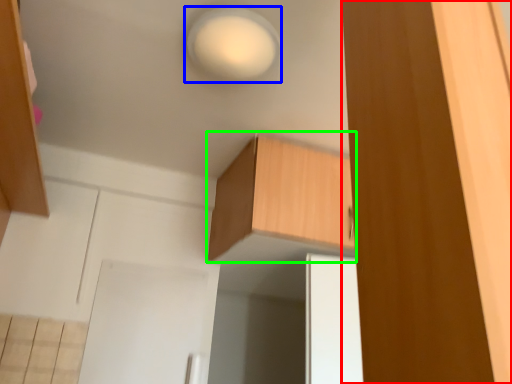
Question: Which object is the farthest from cabinetry (highlighted by a red box)? Choose among these: light (highlighted by a blue box) or cabinetry (highlighted by a green box).

Choices:
 (A) light
 (B) cabinetry

Answer: (B)